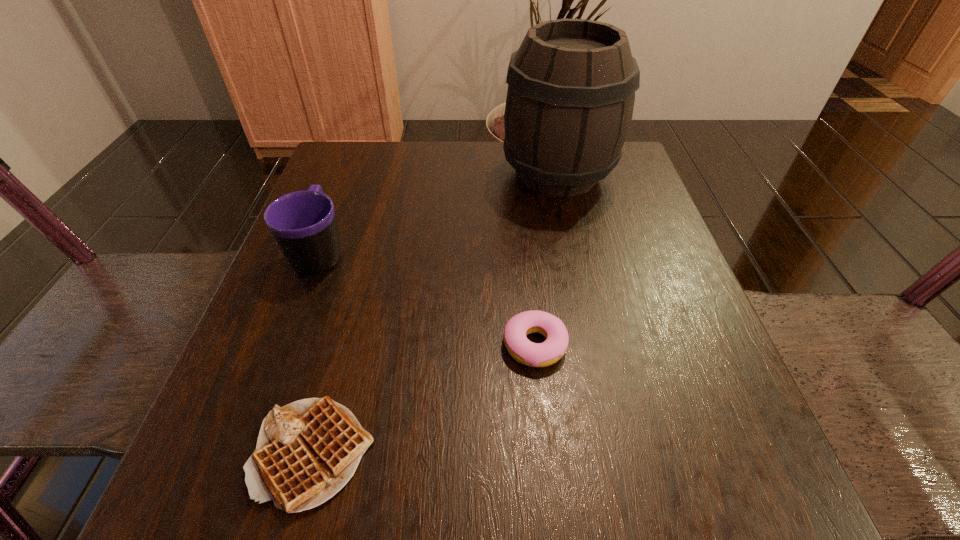
Identify the location of empty space between the third nearest object and the farthest object. (439, 213).

This screenshot has width=960, height=540. In order to click on vacant space in between the mug and the waffle in this screenshot , I will do `click(317, 353)`.

What are the coordinates of `free spot between the third shortest object and the nearest object` in the screenshot? It's located at (317, 353).

Locate an element on the screen. free spot between the third farthest object and the mug is located at coordinates (427, 299).

Locate an element on the screen. free area in between the wine bucket and the second farthest object is located at coordinates (439, 213).

The height and width of the screenshot is (540, 960). Find the location of `vacant area between the waffle and the doughnut`. vacant area between the waffle and the doughnut is located at coordinates (423, 400).

At what (x,y) coordinates should I click in order to perform the action: click on object identified as the third closest to the doughnut. Please return your answer as a coordinate pair (x, y). The image size is (960, 540). Looking at the image, I should click on (571, 90).

I want to click on object that is the closest to the wine bucket, so click(x=524, y=351).

This screenshot has width=960, height=540. In order to click on vacant space that satisfies the following two spatial constraints: 1. on the back side of the nearest object; 2. on the right side of the tallest object in this screenshot , I will do coord(387,174).

Find the location of a particular element. free region that satisfies the following two spatial constraints: 1. with the handle on the side of the farthest object; 2. on the right side of the mug is located at coordinates (348, 174).